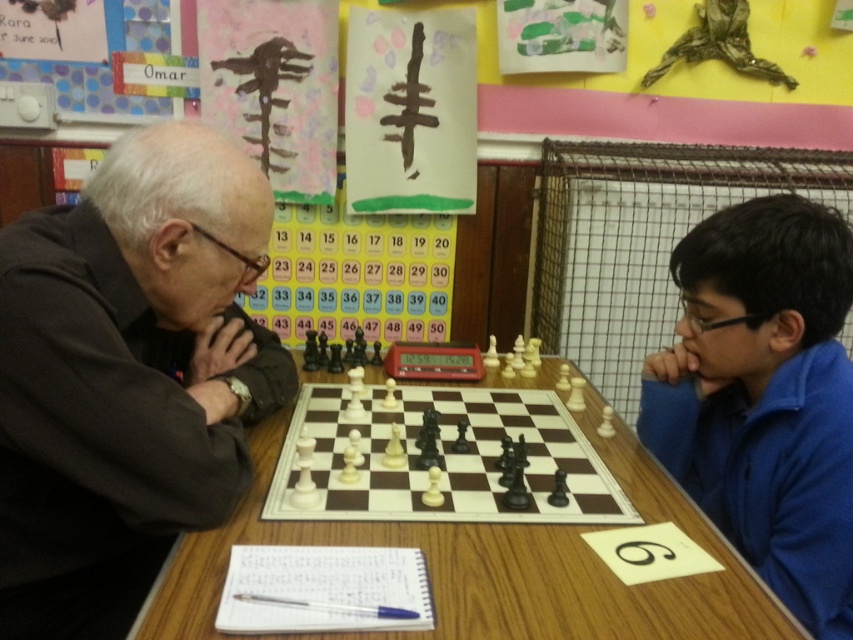
Question: Which is farther from the wooden table at center?

Choices:
 (A) blue fleece jacket at right
 (B) dark brown leather jacket at left
 (C) wooden chessboard at center

Answer: (B)

Question: Is dark brown leather jacket at left positioned behind wooden chessboard at center?

Choices:
 (A) yes
 (B) no

Answer: (B)

Question: Is wooden table at center bigger than wooden chessboard at center?

Choices:
 (A) no
 (B) yes

Answer: (B)

Question: Estimate the real-world distances between objects in this image. Which object is farther from the wooden chessboard at center?

Choices:
 (A) blue fleece jacket at right
 (B) wooden table at center
 (C) dark brown leather jacket at left

Answer: (A)

Question: Based on their relative distances, which object is nearer to the dark brown leather jacket at left?

Choices:
 (A) blue fleece jacket at right
 (B) wooden chessboard at center

Answer: (B)

Question: Does wooden table at center come behind wooden chessboard at center?

Choices:
 (A) no
 (B) yes

Answer: (A)